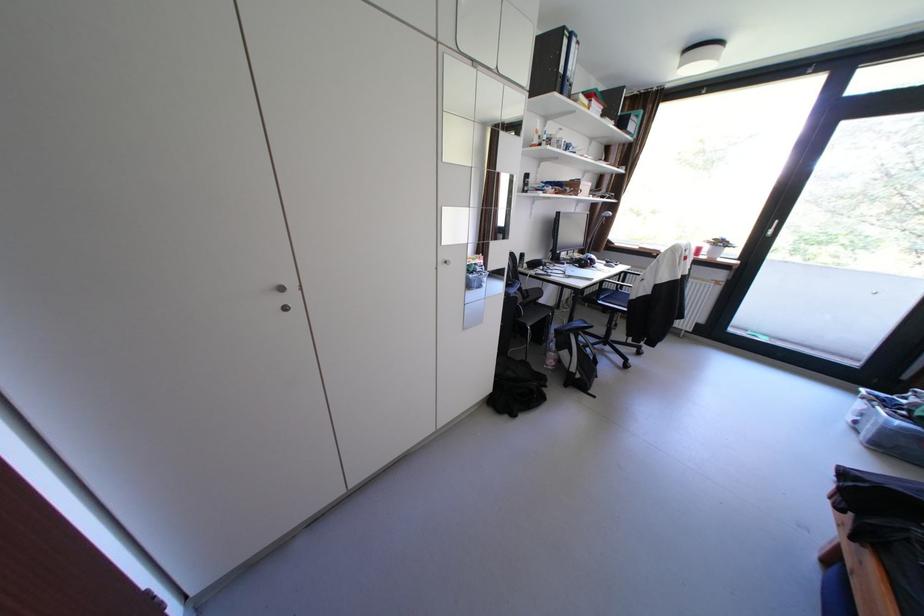
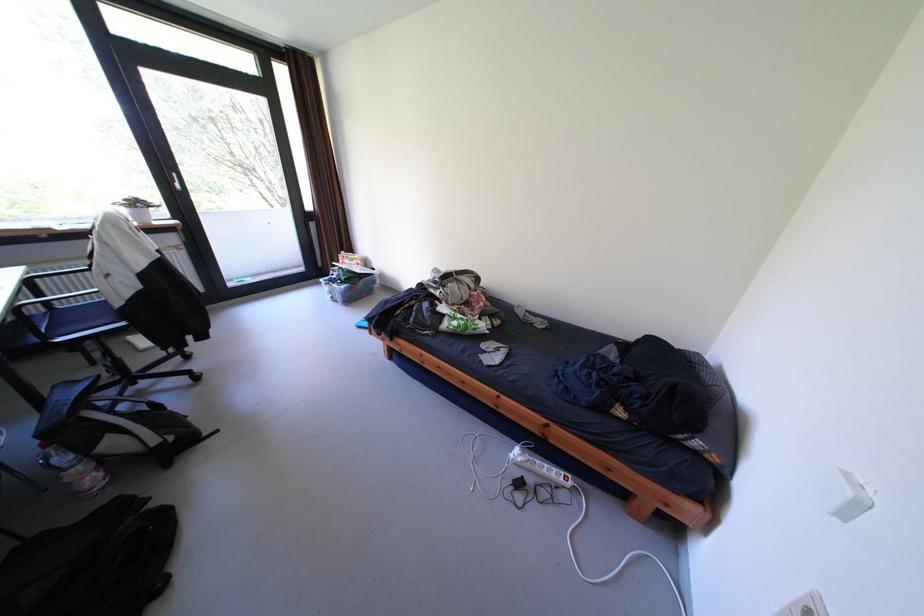
First-person continuous shooting, in which direction is the camera rotating?

The rotation direction of the camera is right-down.